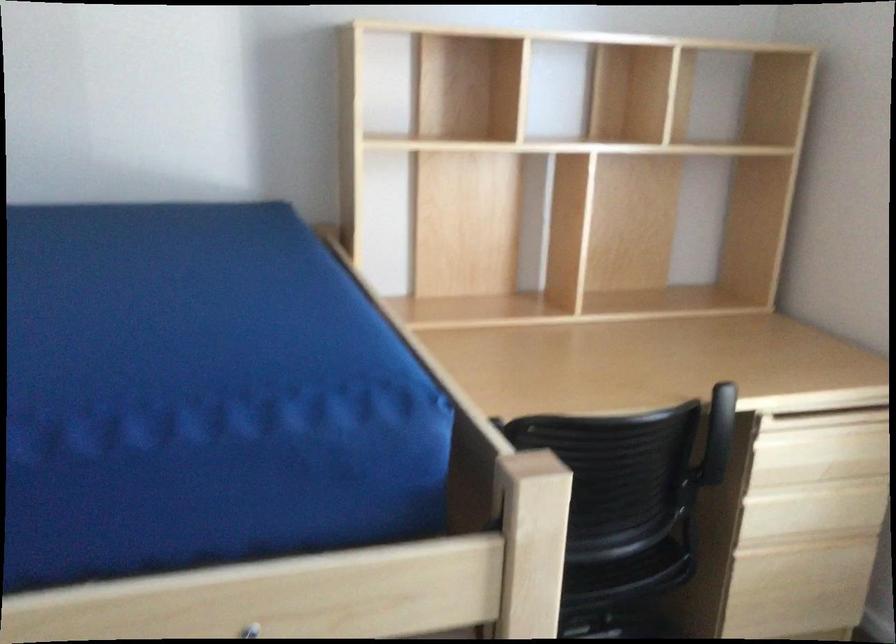
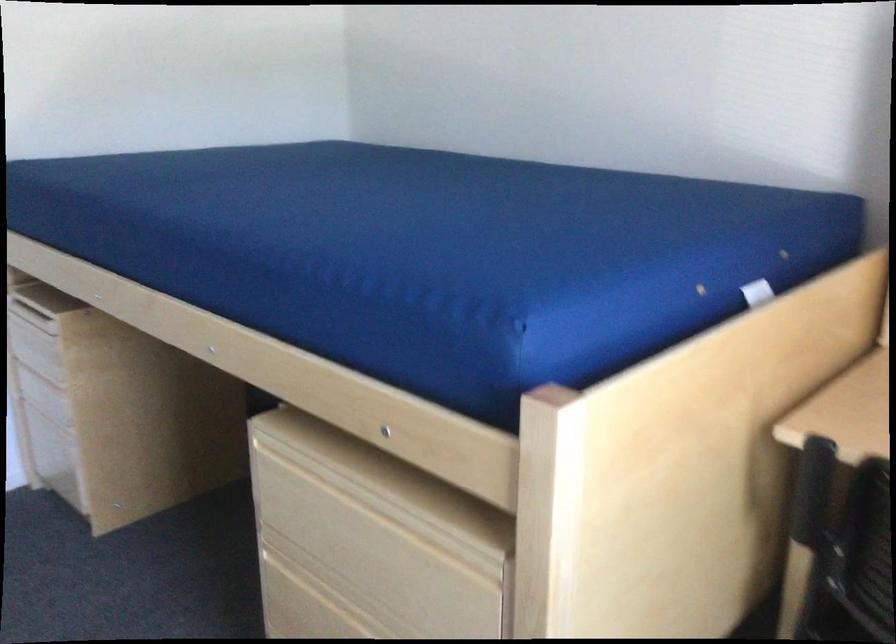
Question: Based on the continuous images, in which direction is the camera rotating? Reply with the corresponding letter.

Choices:
 (A) Left
 (B) Right
 (C) Up
 (D) Down

Answer: (A)